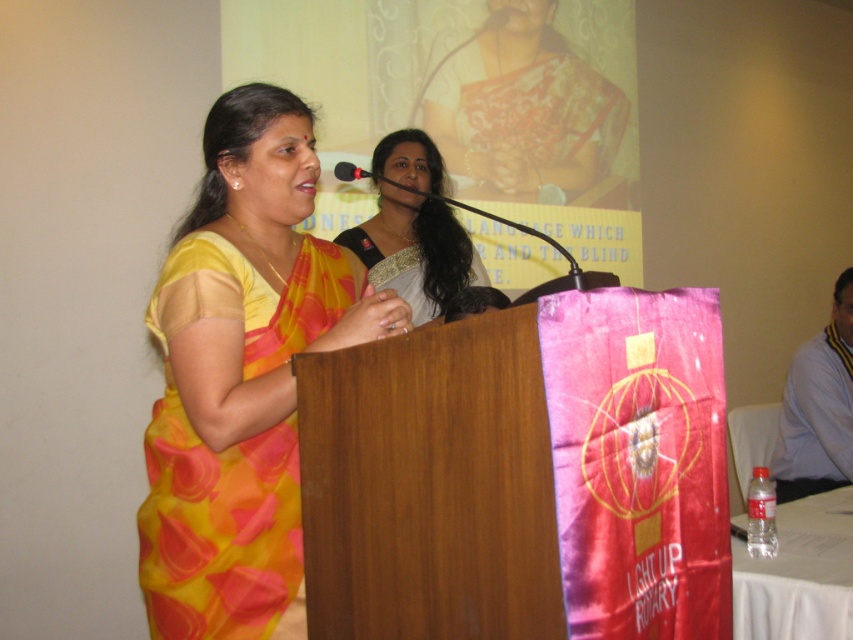
You are a photographer at the event. You need to capture a clear photo of the black plastic microphone at center without the silky white saree at center blocking it. Is this possible given their positions?

The black plastic microphone at center is behind the silky white saree at center, so it would be blocked and not visible in the photo.